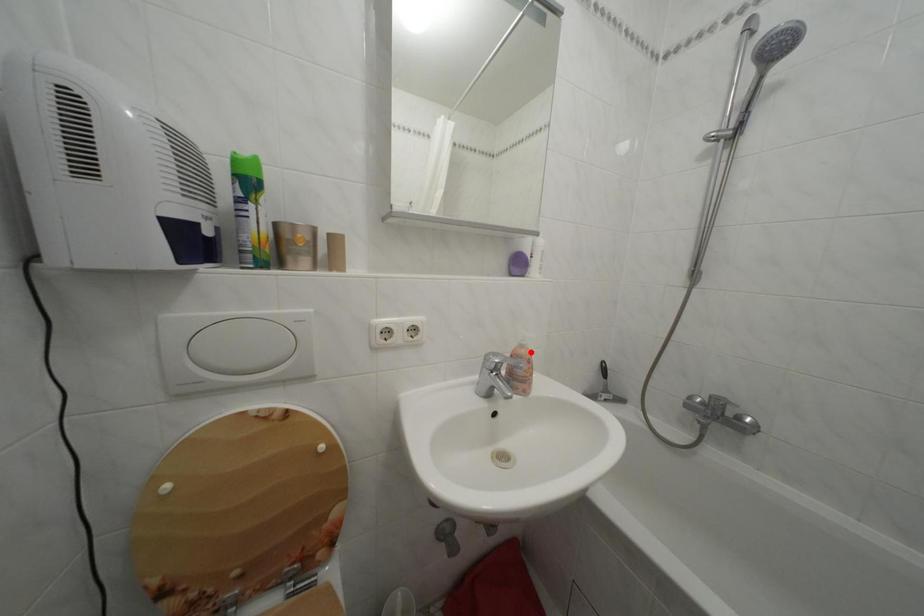
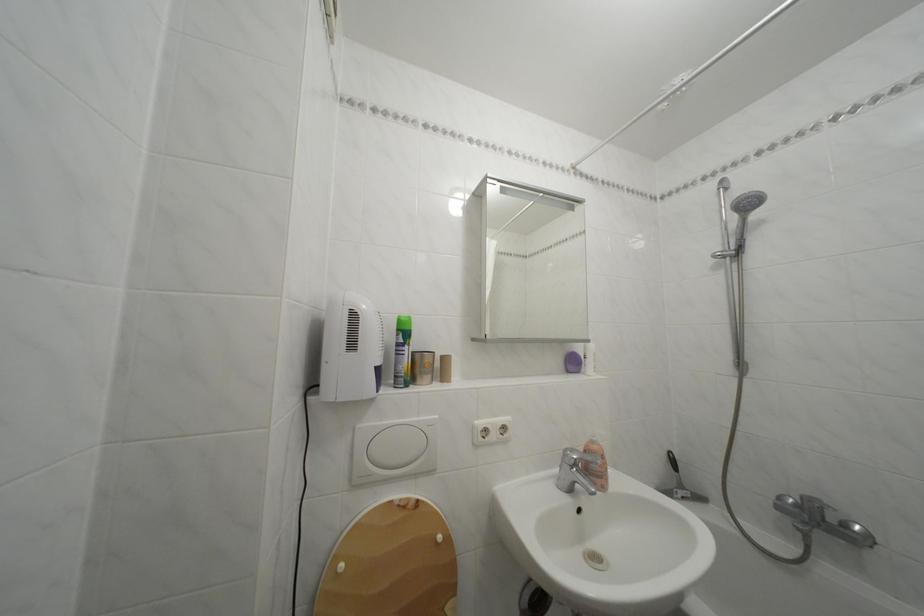
Find the pixel in the second image that matches the highlighted location in the first image.

(602, 448)